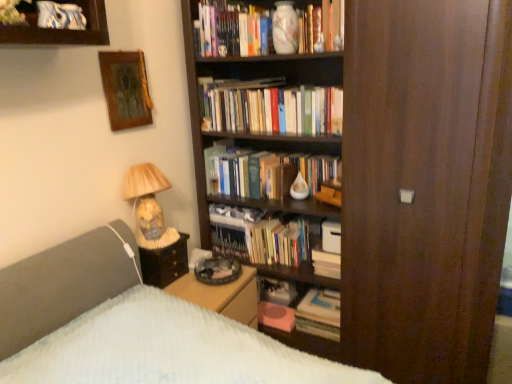
Question: Is wooden picture frame at upper left beside white matte paperback book at center?

Choices:
 (A) yes
 (B) no

Answer: (B)

Question: Can you confirm if wooden picture frame at upper left is taller than white matte paperback book at center?

Choices:
 (A) no
 (B) yes

Answer: (B)

Question: From a real-world perspective, is wooden picture frame at upper left under white matte paperback book at center?

Choices:
 (A) yes
 (B) no

Answer: (B)

Question: Are wooden picture frame at upper left and white matte paperback book at center far apart?

Choices:
 (A) yes
 (B) no

Answer: (A)

Question: Can you confirm if wooden picture frame at upper left is bigger than white matte paperback book at center?

Choices:
 (A) no
 (B) yes

Answer: (B)

Question: Does point (104, 69) appear closer or farther from the camera than point (331, 256)?

Choices:
 (A) farther
 (B) closer

Answer: (B)

Question: Visually, is wooden picture frame at upper left positioned to the left or to the right of white paper stack at center, the 2th book from the top?

Choices:
 (A) right
 (B) left

Answer: (B)

Question: In terms of size, does wooden picture frame at upper left appear bigger or smaller than white paper stack at center, placed as the second book when sorted from bottom to top?

Choices:
 (A) big
 (B) small

Answer: (A)

Question: Is wooden picture frame at upper left in front of or behind white paper stack at center, the 2th book from the top, in the image?

Choices:
 (A) behind
 (B) front

Answer: (B)

Question: Looking at the image, does white matte paperback book at center seem bigger or smaller compared to hardcover books at center, which is the 3th book from bottom to top?

Choices:
 (A) big
 (B) small

Answer: (B)

Question: Would you say white matte paperback book at center is inside or outside hardcover books at center, which is the 3th book from bottom to top?

Choices:
 (A) outside
 (B) inside

Answer: (A)

Question: Is white matte paperback book at center to the left or to the right of hardcover books at center, the first book in the top-to-bottom sequence, in the image?

Choices:
 (A) left
 (B) right

Answer: (B)

Question: Considering the positions of white matte paperback book at center and hardcover books at center, which is the 3th book from bottom to top, in the image, is white matte paperback book at center taller or shorter than hardcover books at center, which is the 3th book from bottom to top,?

Choices:
 (A) short
 (B) tall

Answer: (A)

Question: Is point (273, 102) closer or farther from the camera than point (145, 163)?

Choices:
 (A) farther
 (B) closer

Answer: (A)

Question: Looking at the image, does hardcover books at center, the first book in the top-to-bottom sequence, seem bigger or smaller compared to matte glass lamp at left?

Choices:
 (A) small
 (B) big

Answer: (A)